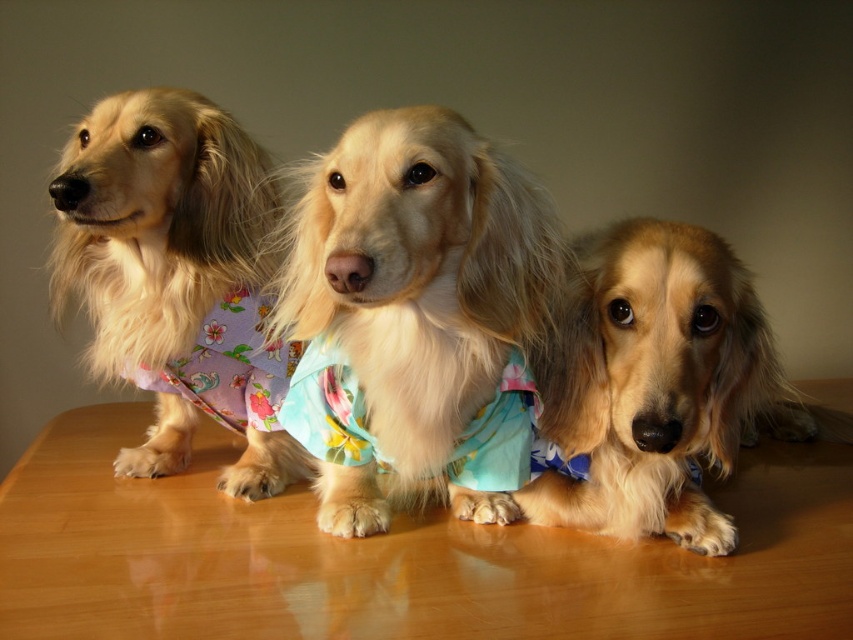
You are a photographer setting up for a photoshoot. You need to ensure that the fluffy fabric dog at center and the floral fabric dress at center are positioned so that they are at least 3 inches apart. Based on the scene description, will their current spacing meet this requirement?

The distance between the fluffy fabric dog at center and the floral fabric dress at center is 3.29 inches, which exceeds the minimum requirement of 3 inches. Therefore, their current spacing meets the requirement.

You are arranging a photo shoot setup and need to place a vase between the wooden table at center and the floral fabric dress at center. Based on their positions, which object should the vase be placed to the left of?

The vase should be placed to the left of the floral fabric dress at center because the wooden table at center is already positioned to the left of it.